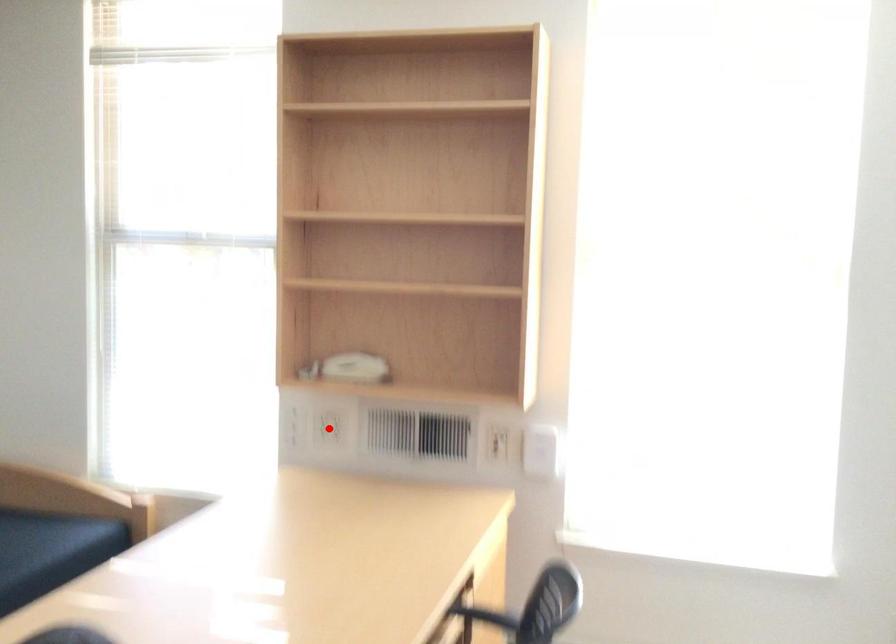
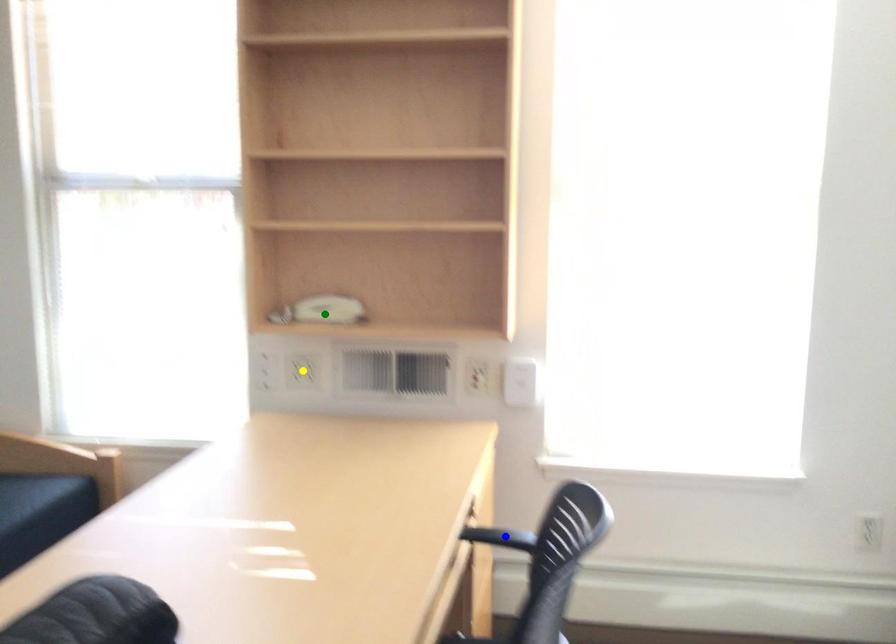
Question: I am providing you with two images of the same scene from different viewpoints. A red point is marked on the first image. You are given multiple points on the second image. Which spot in image 2 lines up with the point in image 1?

Choices:
 (A) blue point
 (B) green point
 (C) yellow point

Answer: (C)